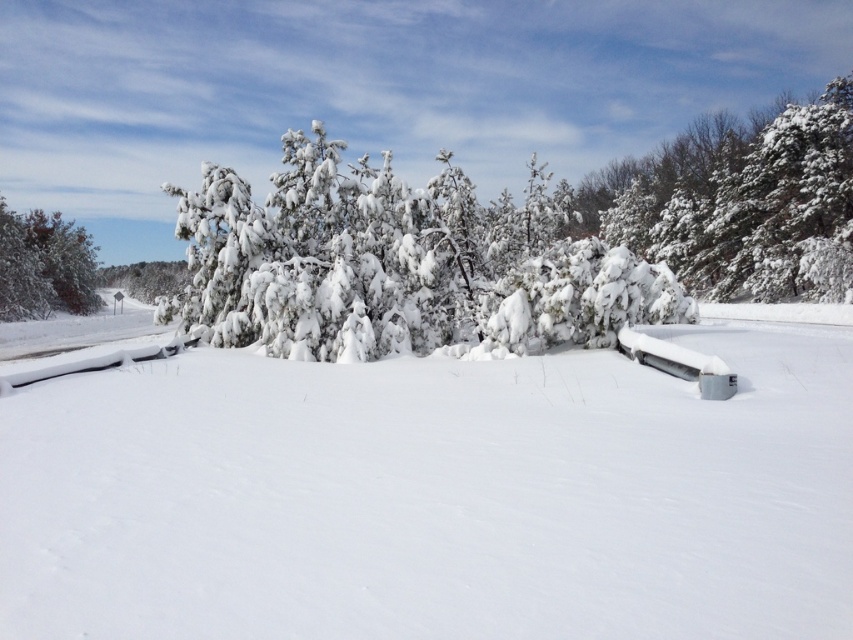
Question: Which point is farther to the camera?

Choices:
 (A) snow-covered evergreen at upper right
 (B) white plastic bench at center
 (C) white fluffy snow at center

Answer: (A)

Question: Where is snow-covered evergreen at upper right located in relation to green matte tree at left in the image?

Choices:
 (A) above
 (B) below

Answer: (A)

Question: Which point is closer to the camera?

Choices:
 (A) white plastic bench at center
 (B) white fluffy snow at center
 (C) white fluffy snow-covered trees at center

Answer: (B)

Question: Does white fluffy snow-covered trees at center appear under snow-covered evergreen at upper right?

Choices:
 (A) no
 (B) yes

Answer: (B)

Question: Which point is farther from the camera taking this photo?

Choices:
 (A) (622, 227)
 (B) (10, 308)
 (C) (306, 605)

Answer: (A)

Question: Does snow-covered evergreen at upper right appear under green matte tree at left?

Choices:
 (A) no
 (B) yes

Answer: (A)